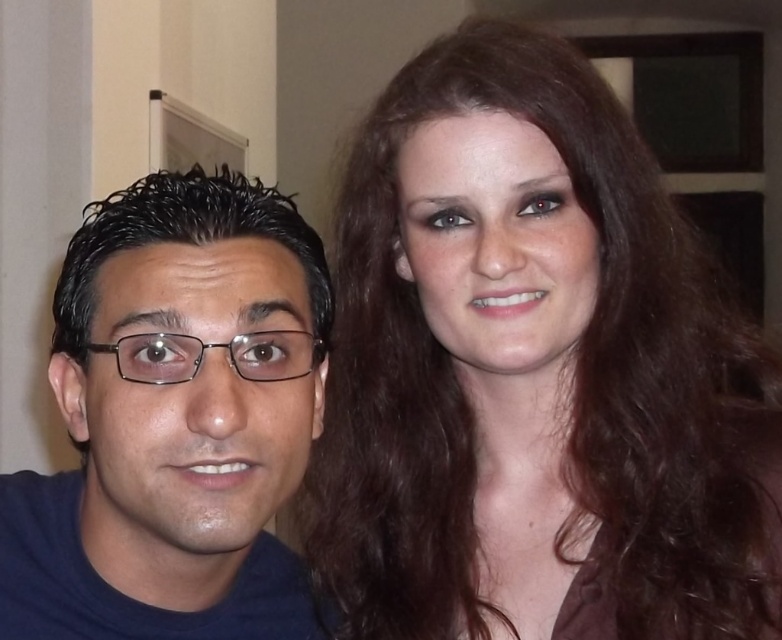
You are standing in front of two people. You see the smooth brown hair at right and the matte black glasses at left. Which object is positioned further to the right?

The smooth brown hair at right is positioned further to the right than the matte black glasses at left.

You are a photographer setting up a camera to take a portrait of the two people in the scene. You need to ensure that both the smooth brown hair at right and the matte black glasses at left are clearly visible in the frame. Considering their heights, which object should you focus on first to ensure proper focus?

The smooth brown hair at right is much taller than the matte black glasses at left. Since the smooth brown hair at right is taller, you should focus on it first to ensure proper focus, as it will be further away from the camera compared to the lower matte black glasses at left.

You are a photographer taking a picture of the man and the woman. The camera you are using has a focal length of 50mm and a sensor size of 24mm x 36mm. The point at coordinates point (698, 513) is located at the center of the frame. Given that the minimum distance between the subjects for a clear photo is 24 inches, will you be able to capture both the man and the woman clearly in this composition?

The man and the woman are 26.02 inches apart, which is greater than the minimum required distance of 24 inches. Therefore, you can capture both clearly in this composition.